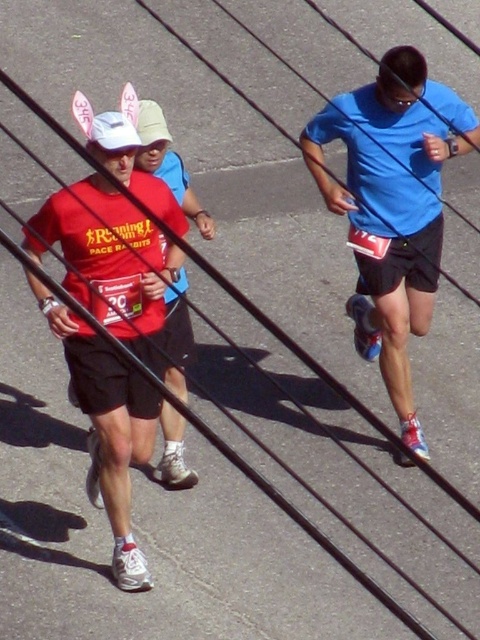
Question: Which object appears farthest from the camera in this image?

Choices:
 (A) blue matte shorts at center
 (B) matte red shirt at left

Answer: (A)

Question: Can you confirm if blue matte shorts at center is thinner than matte red shirt at left?

Choices:
 (A) yes
 (B) no

Answer: (B)

Question: Which object appears farthest from the camera in this image?

Choices:
 (A) blue matte shorts at center
 (B) matte red shirt at left

Answer: (A)

Question: Does blue matte shorts at center appear on the right side of matte red shirt at left?

Choices:
 (A) no
 (B) yes

Answer: (B)

Question: Can you confirm if blue matte shorts at center is positioned above matte red shirt at left?

Choices:
 (A) yes
 (B) no

Answer: (A)